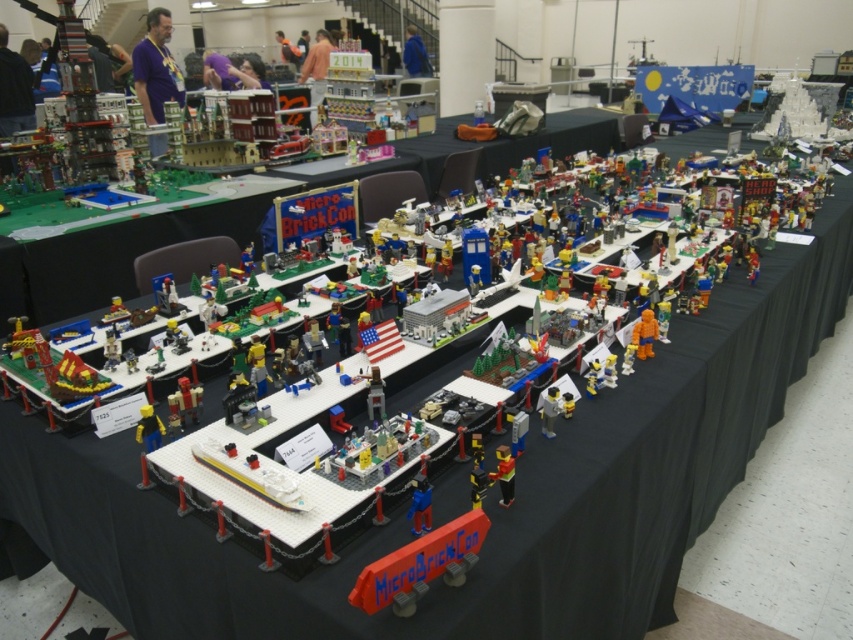
Does orange matte figure at center appear on the right side of translucent plastic minifigure at center?

Indeed, orange matte figure at center is positioned on the right side of translucent plastic minifigure at center.

Does orange matte figure at center appear over translucent plastic minifigure at center?

Yes.

Who is more forward, (651, 339) or (257, 388)?

Positioned in front is point (257, 388).

In order to click on orange matte figure at center in this screenshot , I will do `click(643, 333)`.

Who is lower down, bright yellow plastic minifigure at center or black plastic minifigure at center?

black plastic minifigure at center is below.

What do you see at coordinates (503, 474) in the screenshot?
I see `bright yellow plastic minifigure at center` at bounding box center [503, 474].

Image resolution: width=853 pixels, height=640 pixels. I want to click on bright yellow plastic minifigure at center, so click(x=503, y=474).

Can you confirm if orange matte figure at center is taller than white plastic minifigure at center?

Yes.

Is orange matte figure at center wider than white plastic minifigure at center?

Indeed, orange matte figure at center has a greater width compared to white plastic minifigure at center.

Who is more distant from viewer, (657, 330) or (552, 417)?

The point (657, 330) is more distant.

The height and width of the screenshot is (640, 853). What are the coordinates of `orange matte figure at center` in the screenshot? It's located at (643, 333).